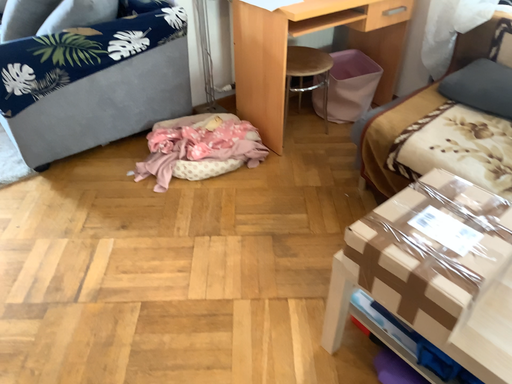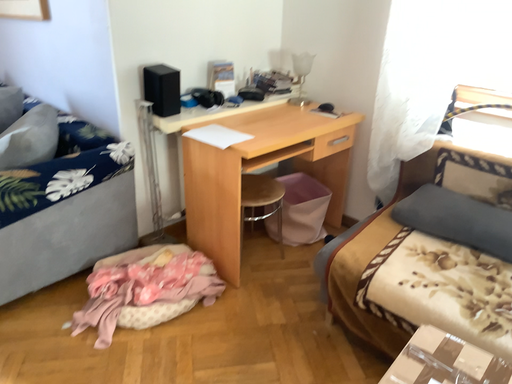
Question: Which way did the camera rotate in the video?

Choices:
 (A) rotated upward
 (B) rotated downward

Answer: (A)